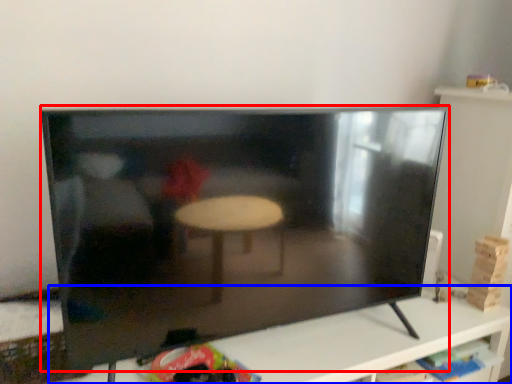
Question: Which of the following is the farthest to the observer, television (highlighted by a red box) or furniture (highlighted by a blue box)?

Choices:
 (A) television
 (B) furniture

Answer: (B)